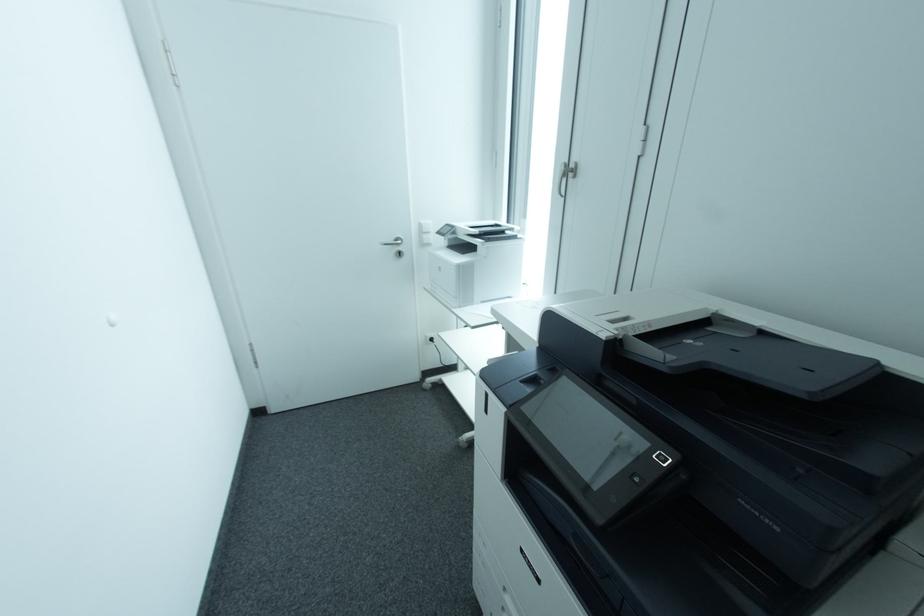
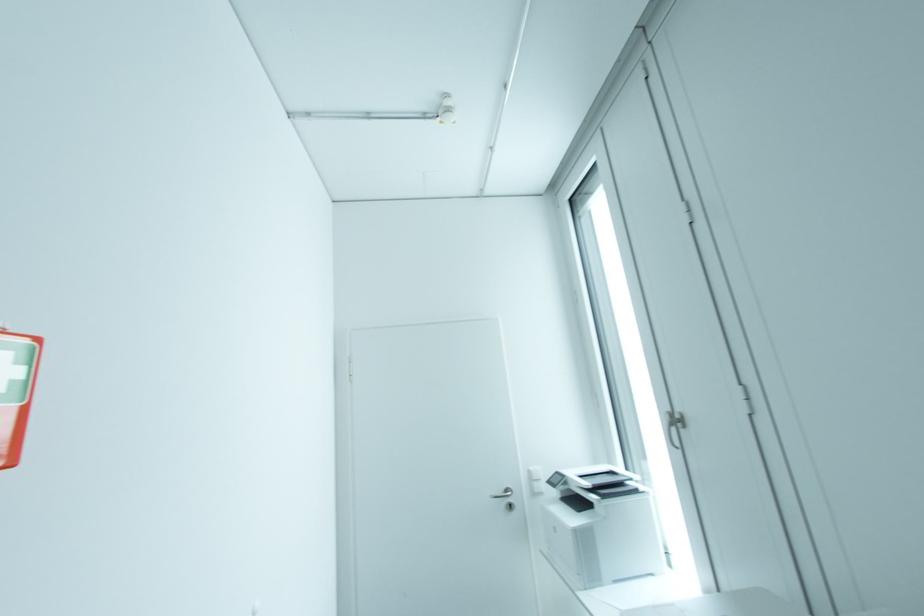
From the picture: The first image is from the beginning of the video and the second image is from the end. How did the camera likely rotate when shooting the video?

The camera rotated toward left-up.